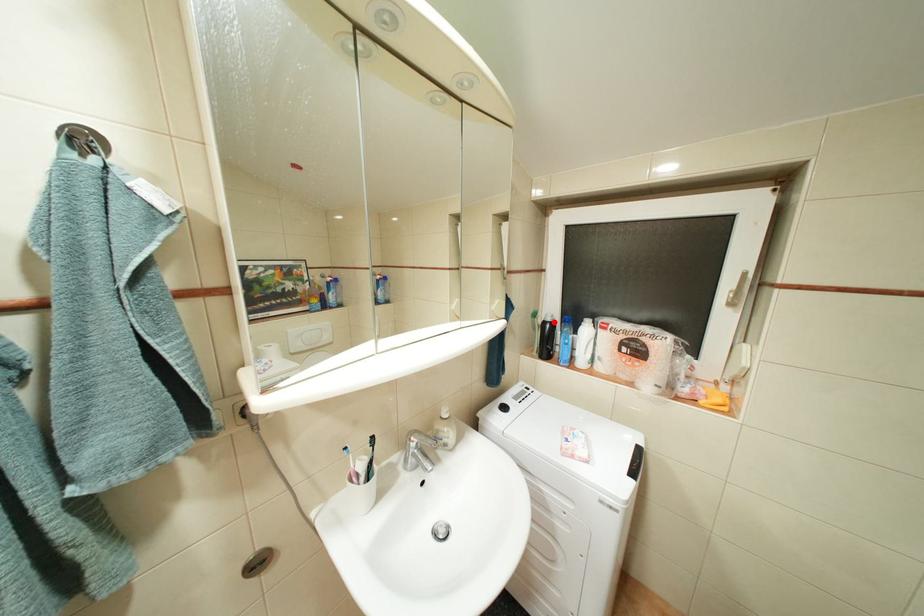
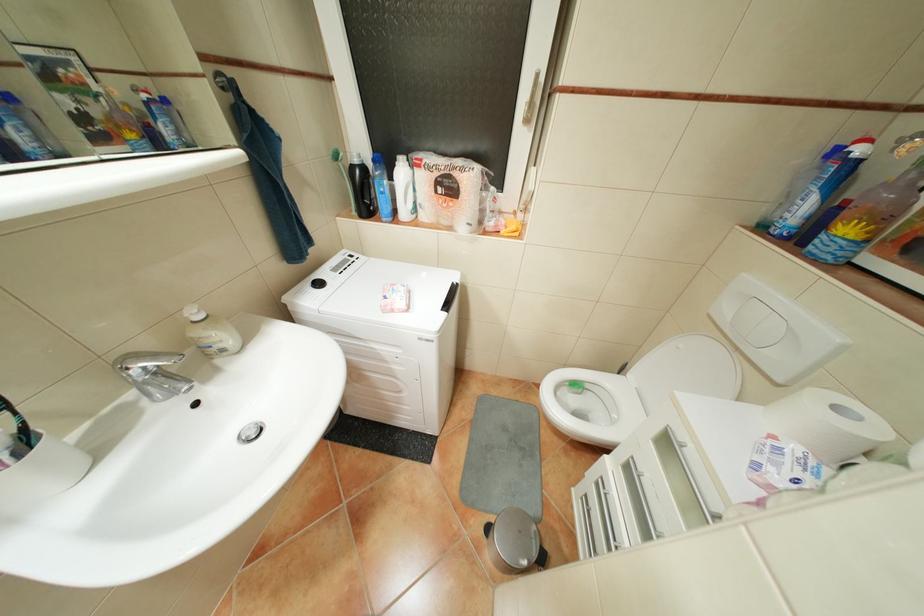
Locate, in the second image, the point that corresponds to the highlighted location in the first image.

(361, 167)